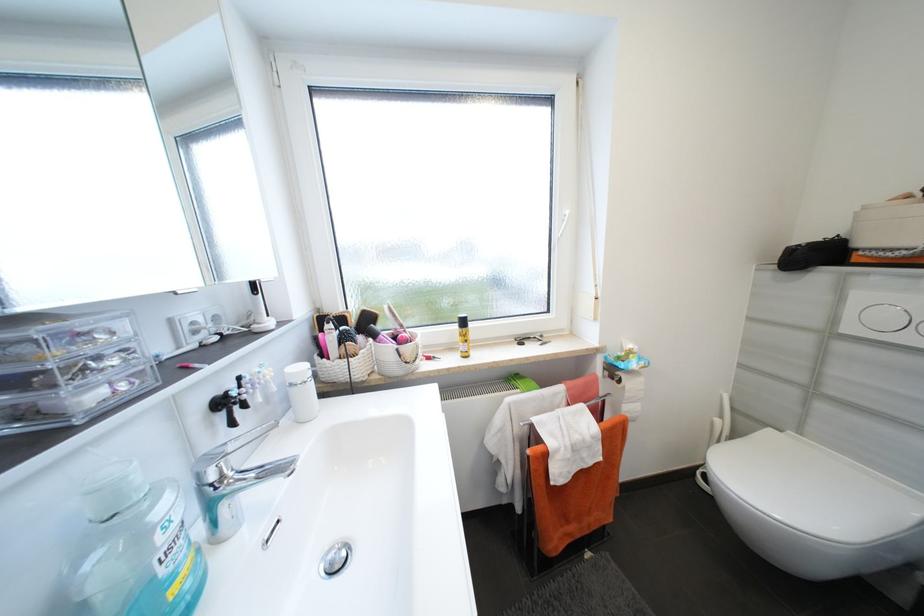
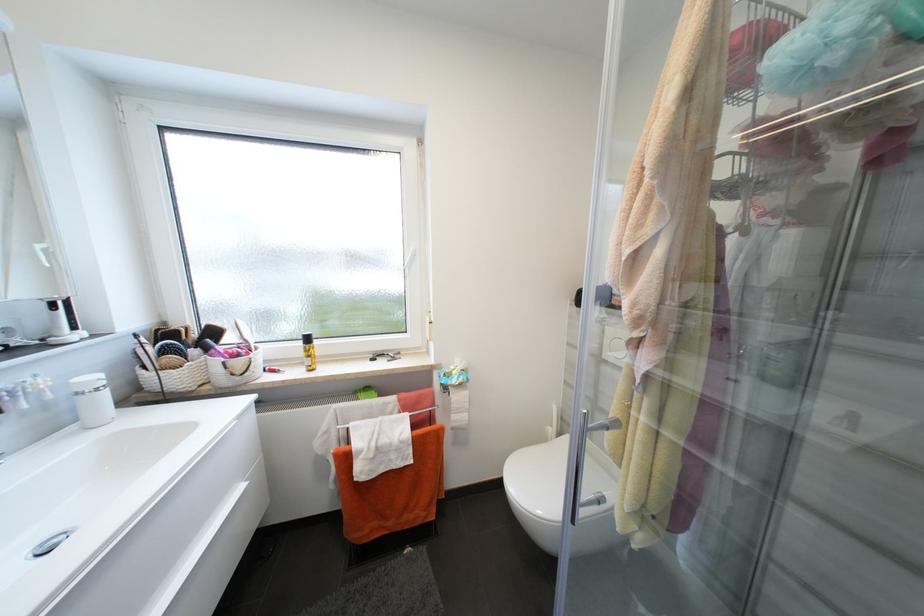
Question: The camera is either moving clockwise (left) or counter-clockwise (right) around the object. The first image is from the beginning of the video and the second image is from the end. Is the camera moving left or right when shooting the video?

Choices:
 (A) Left
 (B) Right

Answer: (A)